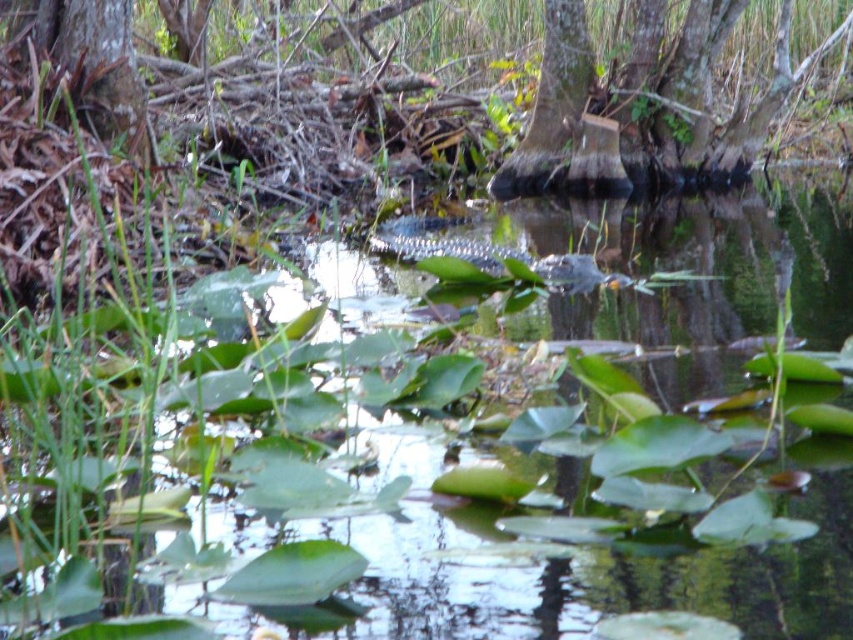
Based on the photo, you are standing on the bank of the swamp and see the green glossy water at center and the smooth bark tree at center. Which object is shorter?

The green glossy water at center is shorter than the smooth bark tree at center.

You are a photographer trying to capture the swamp scene. You want to ensure both the green glossy water at center and the smooth bark tree at center are visible in your photo. Which object will take up more space in the frame?

The smooth bark tree at center occupies more space than the green glossy water at center, so it will take up more space in the frame.